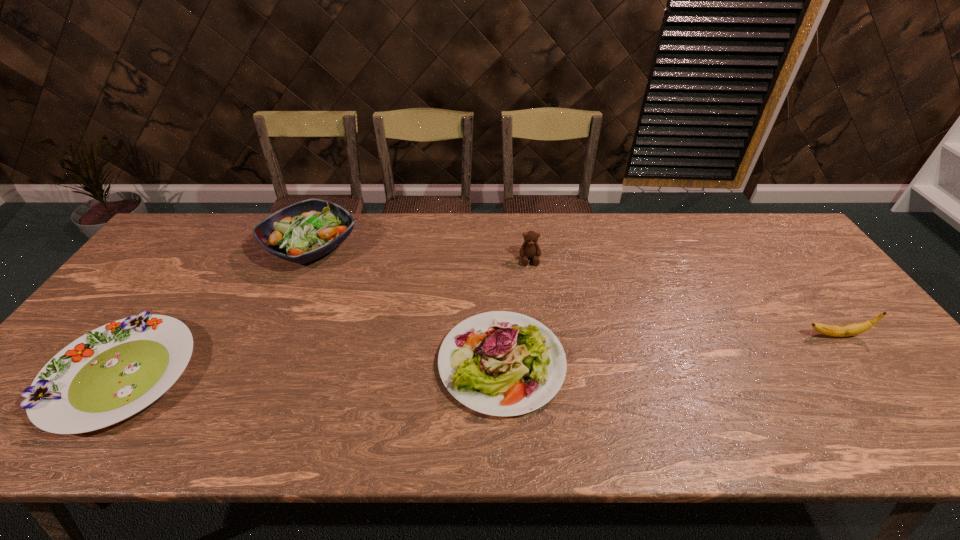
Image resolution: width=960 pixels, height=540 pixels. Find the location of `blank space located on the right of the second tallest salad plate`. blank space located on the right of the second tallest salad plate is located at coordinates (706, 363).

Where is `salad plate present at the far edge`? Image resolution: width=960 pixels, height=540 pixels. salad plate present at the far edge is located at coordinates (304, 231).

The width and height of the screenshot is (960, 540). What are the coordinates of `teddy bear located in the far edge section of the desktop` in the screenshot? It's located at (530, 249).

The width and height of the screenshot is (960, 540). What are the coordinates of `object at the near edge` in the screenshot? It's located at (500, 363).

At what (x,y) coordinates should I click in order to perform the action: click on object present at the right edge. Please return your answer as a coordinate pair (x, y). Looking at the image, I should click on (852, 329).

This screenshot has height=540, width=960. Identify the location of free space at the far edge of the desktop. (483, 214).

The image size is (960, 540). Find the location of `vacant space at the near edge of the desktop`. vacant space at the near edge of the desktop is located at coordinates pos(305,415).

The height and width of the screenshot is (540, 960). Find the location of `vacant space at the left edge`. vacant space at the left edge is located at coordinates [x=137, y=286].

Where is `free spot at the right edge of the desktop`? The height and width of the screenshot is (540, 960). free spot at the right edge of the desktop is located at coordinates (791, 308).

The image size is (960, 540). I want to click on empty space between the rightmost salad plate and the teddy bear, so click(x=516, y=311).